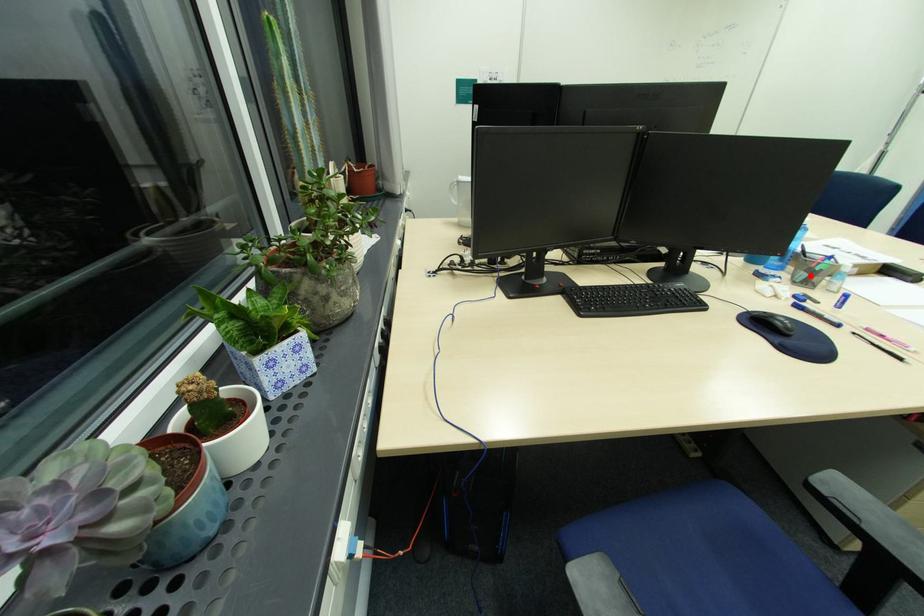
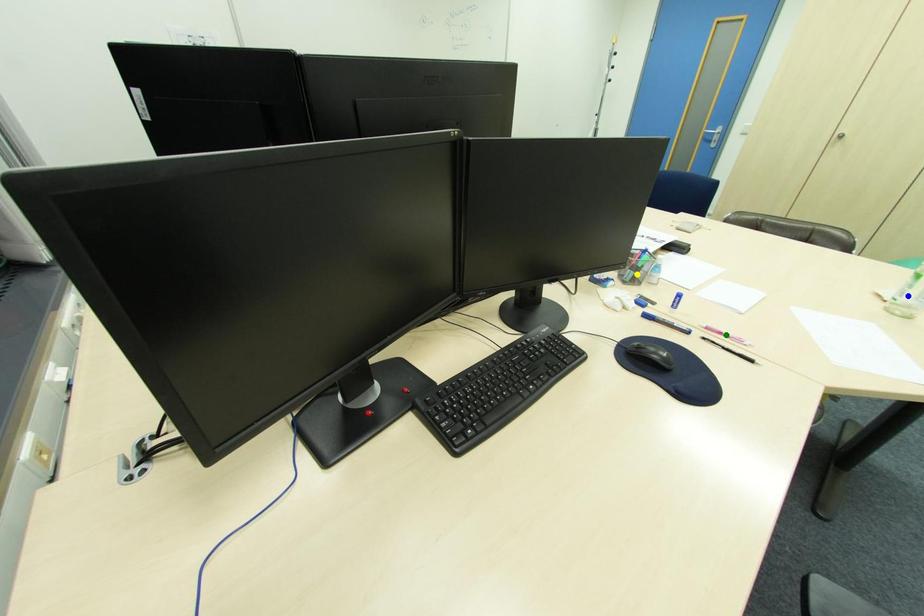
Question: I am providing you with two images of the same scene from different viewpoints. A red point is marked on the first image. You are given multiple points on the second image. Which spot in image 2 lines up with the point in image 1?

Choices:
 (A) blue point
 (B) yellow point
 (C) green point

Answer: (B)